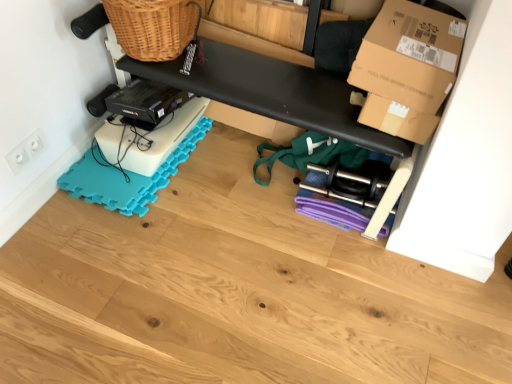
I want to click on empty space that is ontop of wooden floor at lower center (from a real-world perspective), so click(x=234, y=255).